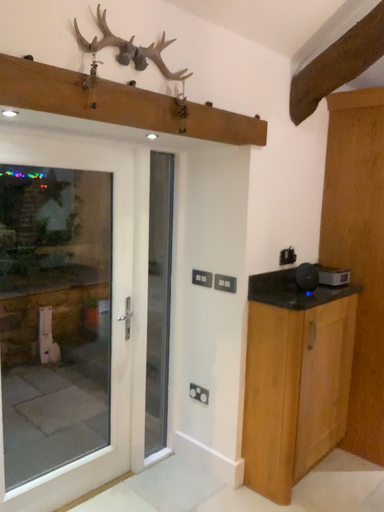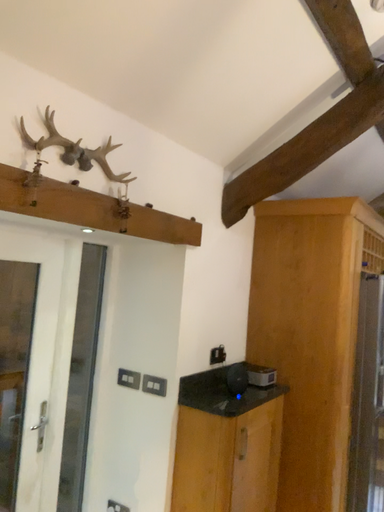
Question: How did the camera likely rotate when shooting the video?

Choices:
 (A) rotated downward
 (B) rotated upward

Answer: (B)